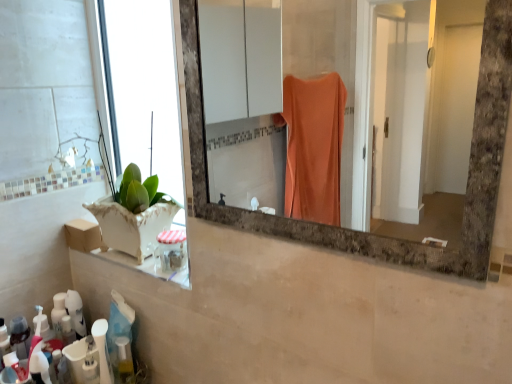
Question: From a real-world perspective, is white plastic bottle at lower left, marked as the 3th toiletry in a left-to-right arrangement, physically above clear plastic jar at lower left, the first toiletry viewed from the right?

Choices:
 (A) no
 (B) yes

Answer: (A)

Question: From a real-world perspective, is white plastic bottle at lower left, placed as the 2th toiletry when sorted from top to bottom, positioned under clear plastic jar at lower left, the 4th toiletry in the left-to-right sequence, based on gravity?

Choices:
 (A) yes
 (B) no

Answer: (A)

Question: Considering the relative positions of white plastic bottle at lower left, acting as the second toiletry starting from the right, and clear plastic jar at lower left, the first toiletry viewed from the right, in the image provided, is white plastic bottle at lower left, acting as the second toiletry starting from the right, to the right of clear plastic jar at lower left, the first toiletry viewed from the right, from the viewer's perspective?

Choices:
 (A) yes
 (B) no

Answer: (B)

Question: Is white plastic bottle at lower left, acting as the second toiletry starting from the right, smaller than clear plastic jar at lower left, the 4th toiletry in the left-to-right sequence?

Choices:
 (A) no
 (B) yes

Answer: (B)

Question: Is white plastic bottle at lower left, which is the 3th toiletry from bottom to top, taller than clear plastic jar at lower left, the 4th toiletry in the left-to-right sequence?

Choices:
 (A) yes
 (B) no

Answer: (A)

Question: From the image's perspective, is white plastic bottle at lower left, placed as the 2th toiletry when sorted from top to bottom, located above clear plastic jar at lower left, which is the 4th toiletry from bottom to top?

Choices:
 (A) yes
 (B) no

Answer: (B)

Question: Is translucent plastic toothbrush at lower left, which is the first toiletry in bottom-to-top order, thinner than white plastic bottle at lower left, which is the 3th toiletry from bottom to top?

Choices:
 (A) no
 (B) yes

Answer: (A)

Question: Would you say translucent plastic toothbrush at lower left, acting as the fourth toiletry starting from the right, is a long distance from white plastic bottle at lower left, acting as the second toiletry starting from the right?

Choices:
 (A) yes
 (B) no

Answer: (B)

Question: Does translucent plastic toothbrush at lower left, which is the first toiletry in bottom-to-top order, turn towards white plastic bottle at lower left, acting as the second toiletry starting from the right?

Choices:
 (A) no
 (B) yes

Answer: (A)

Question: Is translucent plastic toothbrush at lower left, the fourth toiletry from the top, at the left side of white plastic bottle at lower left, marked as the 3th toiletry in a left-to-right arrangement?

Choices:
 (A) no
 (B) yes

Answer: (B)

Question: Considering the relative sizes of translucent plastic toothbrush at lower left, the first toiletry from the left, and white plastic bottle at lower left, which is the 3th toiletry from bottom to top, in the image provided, is translucent plastic toothbrush at lower left, the first toiletry from the left, wider than white plastic bottle at lower left, which is the 3th toiletry from bottom to top,?

Choices:
 (A) no
 (B) yes

Answer: (B)

Question: From a real-world perspective, is translucent plastic toothbrush at lower left, which is the first toiletry in bottom-to-top order, positioned under white plastic bottle at lower left, which is the 3th toiletry from bottom to top, based on gravity?

Choices:
 (A) yes
 (B) no

Answer: (A)

Question: Is marble frame mirror at center facing away from white glossy lotion at lower left, placed as the 3th toiletry when sorted from top to bottom?

Choices:
 (A) yes
 (B) no

Answer: (B)